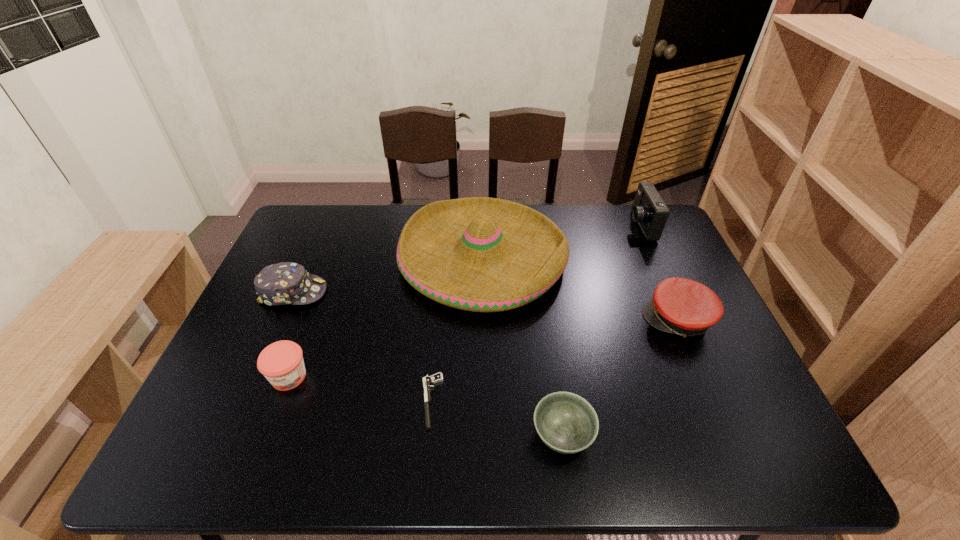
You are a GUI agent. You are given a task and a screenshot of the screen. Output one action in this format:
    pyautogui.click(x=<x>, y=<y>)
    Task: Click on the unoccupied area between the jam and the shortest object
    Image resolution: width=960 pixels, height=540 pixels.
    Given the screenshot: What is the action you would take?
    pyautogui.click(x=360, y=389)

The image size is (960, 540). What are the coordinates of `object identified as the fourth closest to the left cap` in the screenshot? It's located at (567, 423).

Find the location of a particular element. This screenshot has height=540, width=960. object that stands as the fourth closest to the right cap is located at coordinates pyautogui.click(x=438, y=377).

In order to click on vacant space that satisfies the following two spatial constraints: 1. on the back side of the second shortest object; 2. on the front-facing side of the left cap in this screenshot , I will do `click(541, 292)`.